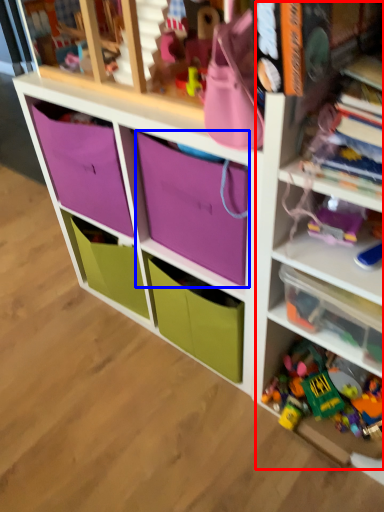
Question: Among these objects, which one is nearest to the camera, bookshelf (highlighted by a red box) or storage box (highlighted by a blue box)?

Choices:
 (A) bookshelf
 (B) storage box

Answer: (A)